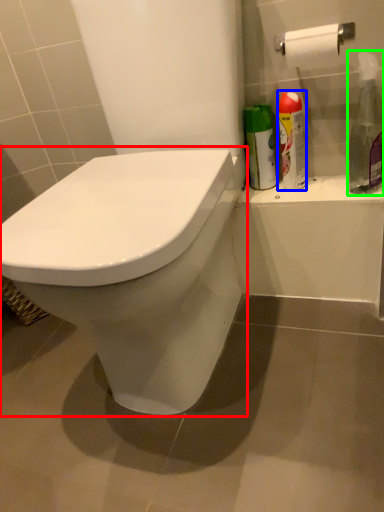
Question: Which is farther away from toilet (highlighted by a red box)? cleaning product (highlighted by a blue box) or cleaning product (highlighted by a green box)?

Choices:
 (A) cleaning product
 (B) cleaning product

Answer: (B)